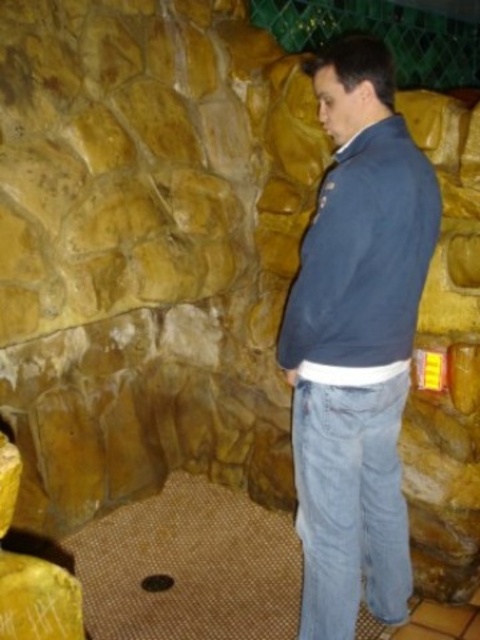
Question: Is blue denim jeans at center to the right of blue fleece sweatshirt at right from the viewer's perspective?

Choices:
 (A) no
 (B) yes

Answer: (A)

Question: Does blue denim jeans at center have a smaller size compared to blue fleece sweatshirt at right?

Choices:
 (A) yes
 (B) no

Answer: (B)

Question: Which point appears closest to the camera in this image?

Choices:
 (A) (304, 256)
 (B) (358, 225)

Answer: (B)

Question: Observing the image, what is the correct spatial positioning of blue denim jeans at center in reference to blue fleece sweatshirt at right?

Choices:
 (A) above
 (B) below

Answer: (B)